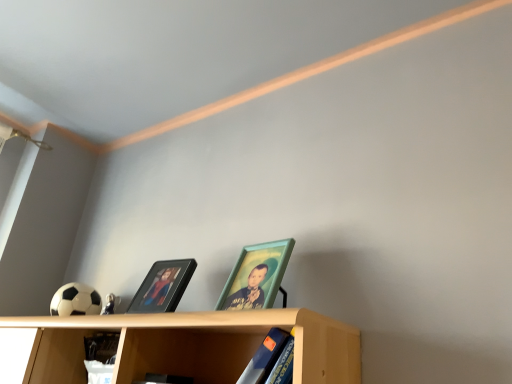
The height and width of the screenshot is (384, 512). What do you see at coordinates (265, 357) in the screenshot?
I see `blue matte book at lower center` at bounding box center [265, 357].

This screenshot has height=384, width=512. I want to click on black glossy picture frame at center, marked as the first picture frame in a left-to-right arrangement, so click(163, 286).

Locate an element on the screen. teal wooden picture frame at center, positioned as the 2th picture frame in left-to-right order is located at coordinates (256, 276).

Which of these two, blue matte book at lower center or black glossy picture frame at center, the 2th picture frame viewed from the right, is wider?

blue matte book at lower center is wider.

Which of these two, blue matte book at lower center or black glossy picture frame at center, marked as the first picture frame in a left-to-right arrangement, stands shorter?

black glossy picture frame at center, marked as the first picture frame in a left-to-right arrangement.

Can you confirm if blue matte book at lower center is bigger than black glossy picture frame at center, marked as the first picture frame in a left-to-right arrangement?

Indeed, blue matte book at lower center has a larger size compared to black glossy picture frame at center, marked as the first picture frame in a left-to-right arrangement.

Is blue matte book at lower center located outside black glossy picture frame at center, marked as the first picture frame in a left-to-right arrangement?

Indeed, blue matte book at lower center is completely outside black glossy picture frame at center, marked as the first picture frame in a left-to-right arrangement.

Is teal wooden picture frame at center, the first picture frame from the right, behind blue matte book at lower center?

Yes, teal wooden picture frame at center, the first picture frame from the right, is behind blue matte book at lower center.

Does point (252, 259) come in front of point (259, 360)?

No, (252, 259) is behind (259, 360).

Is blue matte book at lower center closer to the viewer compared to teal wooden picture frame at center, the first picture frame from the right?

Yes, blue matte book at lower center is in front of teal wooden picture frame at center, the first picture frame from the right.

Can you confirm if blue matte book at lower center is thinner than teal wooden picture frame at center, positioned as the 2th picture frame in left-to-right order?

No.

From a real-world perspective, does blue matte book at lower center sit lower than teal wooden picture frame at center, the first picture frame from the right?

Yes, from a real-world perspective, blue matte book at lower center is below teal wooden picture frame at center, the first picture frame from the right.

From the image's perspective, is blue matte book at lower center positioned above or below teal wooden picture frame at center, positioned as the 2th picture frame in left-to-right order?

Based on their image positions, blue matte book at lower center is located beneath teal wooden picture frame at center, positioned as the 2th picture frame in left-to-right order.

Which of these two, black glossy picture frame at center, the 2th picture frame viewed from the right, or blue matte book at lower center, stands taller?

With more height is blue matte book at lower center.

Identify the location of book that is under the black glossy picture frame at center, marked as the first picture frame in a left-to-right arrangement (from a real-world perspective). This screenshot has height=384, width=512. (265, 357).

What's the angular difference between black glossy picture frame at center, marked as the first picture frame in a left-to-right arrangement, and blue matte book at lower center's facing directions?

1.38 degrees separate the facing orientations of black glossy picture frame at center, marked as the first picture frame in a left-to-right arrangement, and blue matte book at lower center.

Based on their sizes in the image, would you say black glossy picture frame at center, marked as the first picture frame in a left-to-right arrangement, is bigger or smaller than blue matte book at lower center?

Clearly, black glossy picture frame at center, marked as the first picture frame in a left-to-right arrangement, is smaller in size than blue matte book at lower center.

Is light wood shelf at lower center positioned in front of black glossy picture frame at center, marked as the first picture frame in a left-to-right arrangement?

Yes, light wood shelf at lower center is closer to the camera.

Who is taller, light wood shelf at lower center or black glossy picture frame at center, the 2th picture frame viewed from the right?

light wood shelf at lower center.

Considering the positions of objects light wood shelf at lower center and black glossy picture frame at center, the 2th picture frame viewed from the right, in the image provided, who is more to the left, light wood shelf at lower center or black glossy picture frame at center, the 2th picture frame viewed from the right,?

light wood shelf at lower center is more to the left.

Is black glossy picture frame at center, the 2th picture frame viewed from the right, outside of light wood shelf at lower center?

That's correct, black glossy picture frame at center, the 2th picture frame viewed from the right, is outside of light wood shelf at lower center.

Considering the sizes of objects black glossy picture frame at center, the 2th picture frame viewed from the right, and light wood shelf at lower center in the image provided, who is shorter, black glossy picture frame at center, the 2th picture frame viewed from the right, or light wood shelf at lower center?

With less height is black glossy picture frame at center, the 2th picture frame viewed from the right.

Considering the positions of objects black glossy picture frame at center, marked as the first picture frame in a left-to-right arrangement, and light wood shelf at lower center in the image provided, who is more to the left, black glossy picture frame at center, marked as the first picture frame in a left-to-right arrangement, or light wood shelf at lower center?

light wood shelf at lower center is more to the left.

Looking at this image, is black glossy picture frame at center, the 2th picture frame viewed from the right, facing away from light wood shelf at lower center?

black glossy picture frame at center, the 2th picture frame viewed from the right, is not turned away from light wood shelf at lower center.

Which object is positioned more to the right, teal wooden picture frame at center, the first picture frame from the right, or black glossy picture frame at center, marked as the first picture frame in a left-to-right arrangement?

teal wooden picture frame at center, the first picture frame from the right, is more to the right.

Is teal wooden picture frame at center, the first picture frame from the right, beside black glossy picture frame at center, the 2th picture frame viewed from the right?

No, teal wooden picture frame at center, the first picture frame from the right, is not making contact with black glossy picture frame at center, the 2th picture frame viewed from the right.

Is teal wooden picture frame at center, the first picture frame from the right, situated inside black glossy picture frame at center, marked as the first picture frame in a left-to-right arrangement, or outside?

teal wooden picture frame at center, the first picture frame from the right, is not enclosed by black glossy picture frame at center, marked as the first picture frame in a left-to-right arrangement.

Does point (263, 243) appear closer or farther from the camera than point (141, 289)?

Clearly, point (263, 243) is closer to the camera than point (141, 289).

The height and width of the screenshot is (384, 512). I want to click on book that is under the black glossy picture frame at center, the 2th picture frame viewed from the right (from a real-world perspective), so click(x=265, y=357).

From the image's perspective, which picture frame is the 2nd one above the blue matte book at lower center? Please provide its 2D coordinates.

[(256, 276)]

Based on their spatial positions, is teal wooden picture frame at center, positioned as the 2th picture frame in left-to-right order, or black glossy picture frame at center, marked as the first picture frame in a left-to-right arrangement, further from light wood shelf at lower center?

The object further to light wood shelf at lower center is teal wooden picture frame at center, positioned as the 2th picture frame in left-to-right order.

Considering their positions, is black glossy picture frame at center, the 2th picture frame viewed from the right, positioned closer to light wood shelf at lower center than blue matte book at lower center?

black glossy picture frame at center, the 2th picture frame viewed from the right, is positioned closer to the anchor light wood shelf at lower center.

Consider the image. Estimate the real-world distances between objects in this image. Which object is closer to blue matte book at lower center, light wood shelf at lower center or teal wooden picture frame at center, positioned as the 2th picture frame in left-to-right order?

teal wooden picture frame at center, positioned as the 2th picture frame in left-to-right order, is closer to blue matte book at lower center.

Based on their spatial positions, is light wood shelf at lower center or black glossy picture frame at center, the 2th picture frame viewed from the right, further from teal wooden picture frame at center, the first picture frame from the right?

black glossy picture frame at center, the 2th picture frame viewed from the right, is positioned further to the anchor teal wooden picture frame at center, the first picture frame from the right.

Looking at the image, which one is located closer to black glossy picture frame at center, marked as the first picture frame in a left-to-right arrangement, teal wooden picture frame at center, the first picture frame from the right, or light wood shelf at lower center?

light wood shelf at lower center is positioned closer to the anchor black glossy picture frame at center, marked as the first picture frame in a left-to-right arrangement.

Estimate the real-world distances between objects in this image. Which object is further from blue matte book at lower center, black glossy picture frame at center, the 2th picture frame viewed from the right, or light wood shelf at lower center?

Among the two, black glossy picture frame at center, the 2th picture frame viewed from the right, is located further to blue matte book at lower center.

Estimate the real-world distances between objects in this image. Which object is closer to teal wooden picture frame at center, the first picture frame from the right, blue matte book at lower center or light wood shelf at lower center?

blue matte book at lower center lies closer to teal wooden picture frame at center, the first picture frame from the right, than the other object.

Which object lies further to the anchor point blue matte book at lower center, light wood shelf at lower center or black glossy picture frame at center, marked as the first picture frame in a left-to-right arrangement?

black glossy picture frame at center, marked as the first picture frame in a left-to-right arrangement, is positioned further to the anchor blue matte book at lower center.

Find the location of a particular element. The width and height of the screenshot is (512, 384). picture frame located between light wood shelf at lower center and black glossy picture frame at center, the 2th picture frame viewed from the right, in the depth direction is located at coordinates (256, 276).

This screenshot has width=512, height=384. I want to click on picture frame between blue matte book at lower center and black glossy picture frame at center, the 2th picture frame viewed from the right, along the z-axis, so click(x=256, y=276).

This screenshot has height=384, width=512. I want to click on book between light wood shelf at lower center and black glossy picture frame at center, marked as the first picture frame in a left-to-right arrangement, from front to back, so click(x=265, y=357).